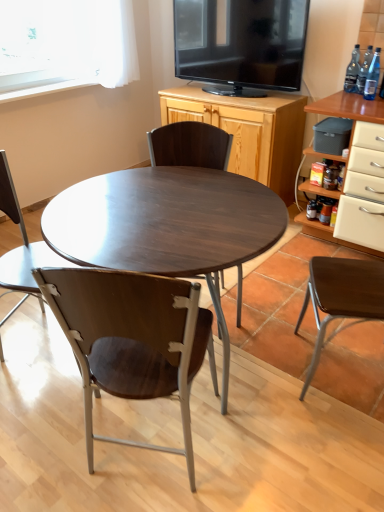
Locate an element on the screen. The height and width of the screenshot is (512, 384). free space between wooden chair at center, the 3th chair viewed from the right, and dark wood/finish coffee table at center is located at coordinates (105, 426).